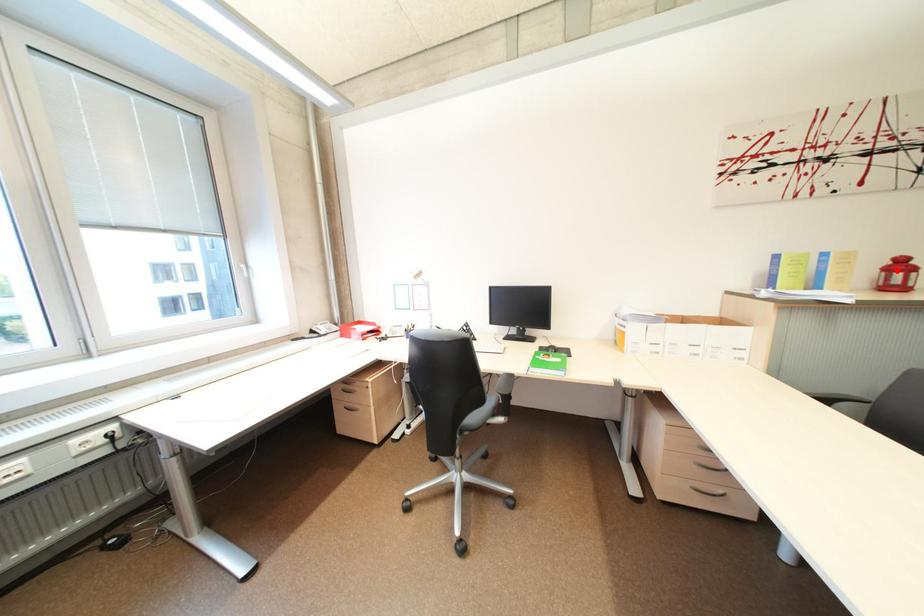
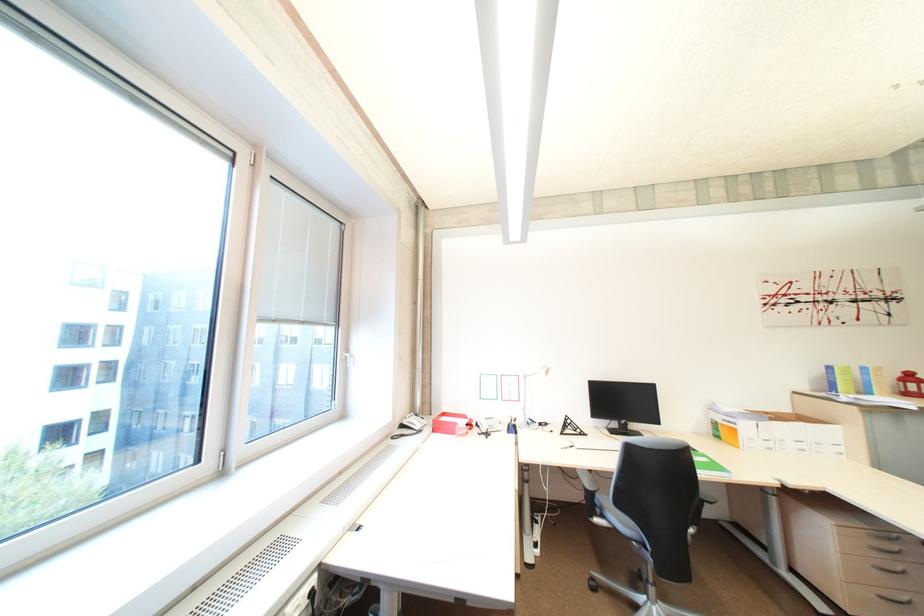
Question: I am providing you with two images of the same scene from different viewpoints. In image1, a red point is highlighted. Considering the same 3D point in image2, which of the following is correct?

Choices:
 (A) It is closer
 (B) It is farther

Answer: (A)